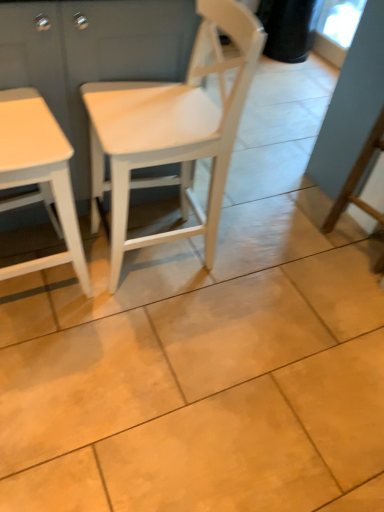
Question: From a real-world perspective, is white matte wood chair at center positioned above or below white matte table at left?

Choices:
 (A) above
 (B) below

Answer: (B)

Question: Is point [x=120, y=190] positioned closer to the camera than point [x=39, y=104]?

Choices:
 (A) closer
 (B) farther

Answer: (B)

Question: Which object is the farthest from the white matte table at left?

Choices:
 (A) white matte wood chair at center
 (B) white wood dresser at left

Answer: (A)

Question: Based on their relative distances, which object is farther from the white wood dresser at left?

Choices:
 (A) white matte table at left
 (B) white matte wood chair at center

Answer: (A)